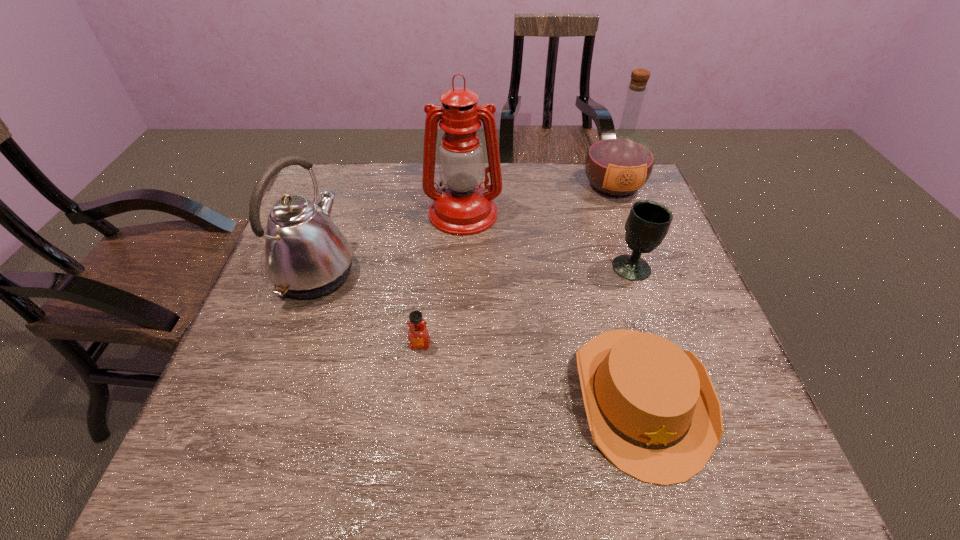
Locate an element on the screen. oil lamp is located at coordinates (462, 207).

You are a GUI agent. You are given a task and a screenshot of the screen. Output one action in this format:
    pyautogui.click(x=<x>, y=<y>)
    Task: Click on the liquor
    
    Given the screenshot: What is the action you would take?
    pyautogui.click(x=618, y=163)

Locate an element on the screen. The image size is (960, 540). the leftmost object is located at coordinates (306, 256).

Where is `the third shortest object`? The height and width of the screenshot is (540, 960). the third shortest object is located at coordinates (648, 222).

Locate an element on the screen. Image resolution: width=960 pixels, height=540 pixels. honey is located at coordinates (418, 335).

The width and height of the screenshot is (960, 540). In order to click on cowboy hat in this screenshot , I will do (652, 409).

Locate an element on the screen. The width and height of the screenshot is (960, 540). vacant space situated on the left of the oil lamp is located at coordinates (307, 213).

The image size is (960, 540). In order to click on free region located on the front label of the liquor in this screenshot , I will do `click(644, 270)`.

Image resolution: width=960 pixels, height=540 pixels. What are the coordinates of `free space located on the right of the leftmost object` in the screenshot? It's located at (428, 273).

Locate an element on the screen. Image resolution: width=960 pixels, height=540 pixels. vacant space situated 0.170m on the front of the third shortest object is located at coordinates (657, 338).